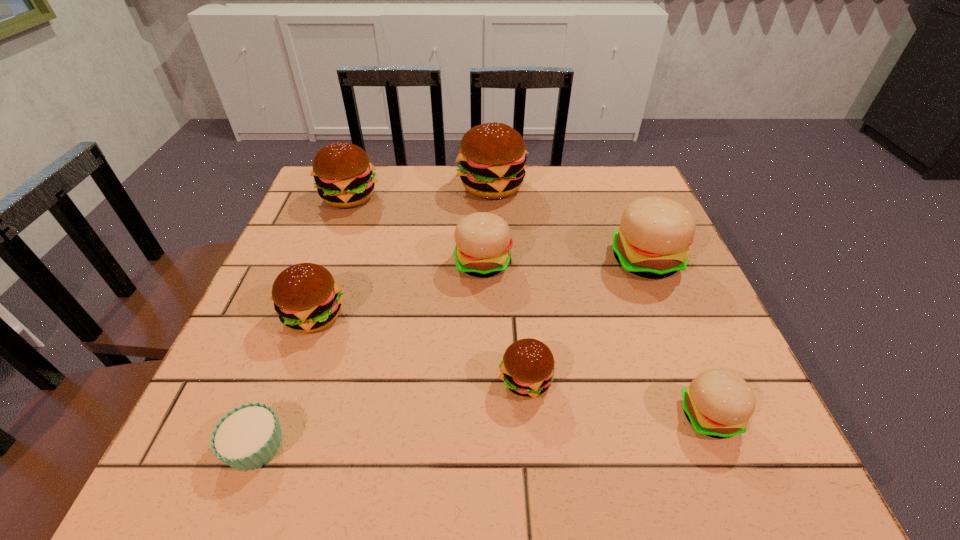
At what (x,y) coordinates should I click in order to perform the action: click on vacant space located on the left of the tallest hamburger. Please return your answer as a coordinate pair (x, y). The width and height of the screenshot is (960, 540). Looking at the image, I should click on (403, 186).

Identify the location of vacant area situated 0.280m on the right of the third smallest brown hamburger. The width and height of the screenshot is (960, 540). (483, 197).

At what (x,y) coordinates should I click in order to perform the action: click on vacant area located on the front of the biggest beige hamburger. Please return your answer as a coordinate pair (x, y). Image resolution: width=960 pixels, height=540 pixels. Looking at the image, I should click on (684, 356).

Identify the location of vacant space located on the front of the fifth farthest hamburger. Image resolution: width=960 pixels, height=540 pixels. (297, 364).

Identify the location of vacant space situated 0.280m on the back of the second biggest beige hamburger. Image resolution: width=960 pixels, height=540 pixels. [x=482, y=181].

Locate an element on the screen. Image resolution: width=960 pixels, height=540 pixels. free space located on the left of the nearest brown hamburger is located at coordinates (414, 381).

This screenshot has width=960, height=540. What are the coordinates of `vacant region located 0.370m on the back of the smallest beige hamburger` in the screenshot? It's located at (643, 252).

Identify the location of vacant space located on the right of the cupcake. (539, 446).

Locate an element on the screen. This screenshot has width=960, height=540. hamburger that is at the near edge is located at coordinates (718, 403).

This screenshot has width=960, height=540. Find the location of `cupcake positioned at the near edge`. cupcake positioned at the near edge is located at coordinates (247, 437).